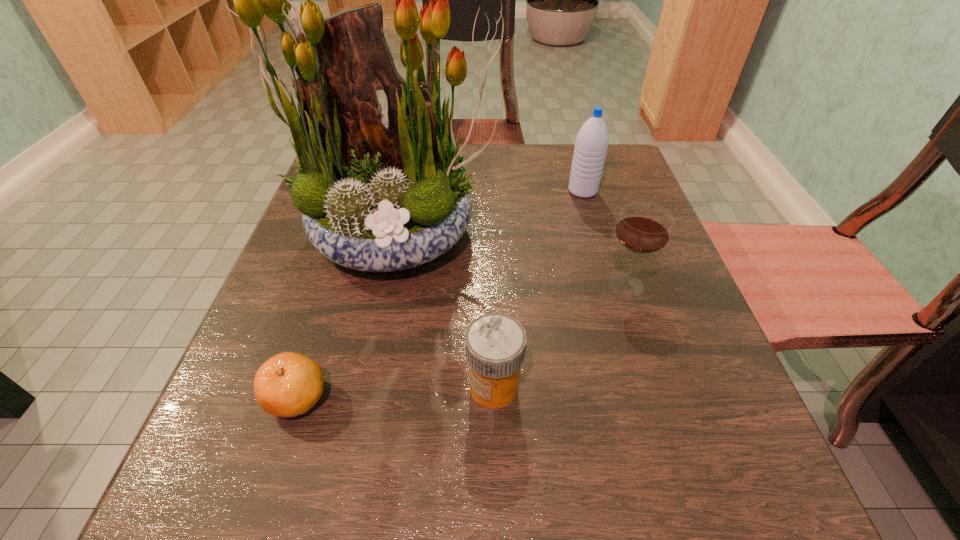
At what (x,y) coordinates should I click in order to perform the action: click on the tallest object. Please return your answer as a coordinate pair (x, y). The image size is (960, 540). Looking at the image, I should click on (377, 196).

Locate an element on the screen. Image resolution: width=960 pixels, height=540 pixels. the second tallest object is located at coordinates (591, 144).

Identify the location of the third shortest object. (644, 228).

This screenshot has width=960, height=540. In order to click on the fourth tallest object in this screenshot , I will do `click(495, 343)`.

Locate an element on the screen. the shortest object is located at coordinates (289, 384).

At what (x,y) coordinates should I click in order to perform the action: click on vacant space located on the front-facing side of the flower arrangement. Please return your answer as a coordinate pair (x, y). The height and width of the screenshot is (540, 960). Looking at the image, I should click on (344, 494).

Locate an element on the screen. This screenshot has height=540, width=960. free space located 0.130m on the front of the water bottle is located at coordinates (596, 238).

Image resolution: width=960 pixels, height=540 pixels. What are the coordinates of `vacant space positioned 0.200m on the front of the third tallest object` in the screenshot? It's located at (665, 408).

I want to click on vacant space located on the label side of the medicine, so click(x=392, y=387).

This screenshot has width=960, height=540. What are the coordinates of `free space located on the label side of the medicine` in the screenshot? It's located at (378, 387).